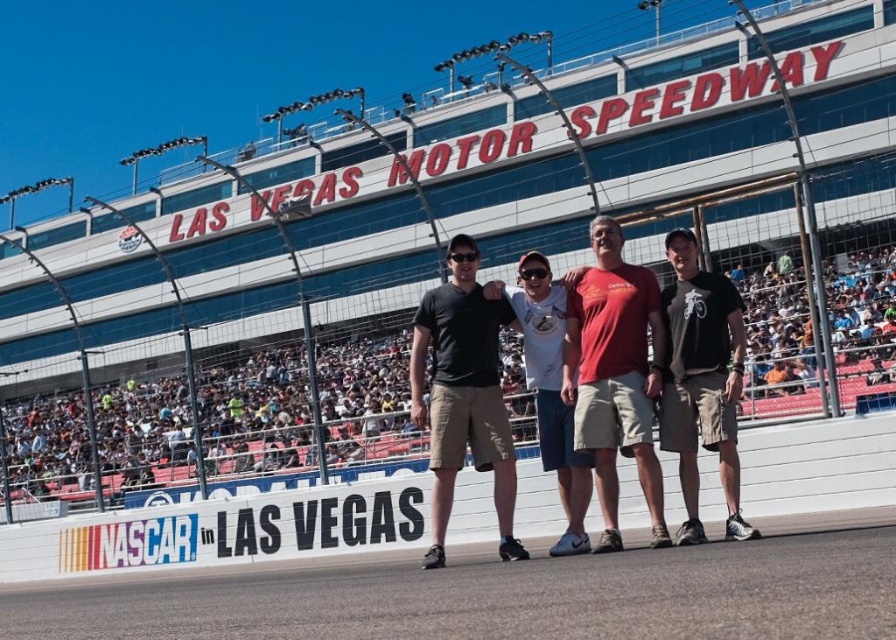
Does gray asphalt dirt track at lower center appear on the left side of matte black t-shirt at center?

Yes, gray asphalt dirt track at lower center is to the left of matte black t-shirt at center.

Between gray asphalt dirt track at lower center and matte black t-shirt at center, which one has more height?

matte black t-shirt at center is taller.

Does point (66, 634) lie in front of point (485, 445)?

Yes.

Where is `gray asphalt dirt track at lower center`? The width and height of the screenshot is (896, 640). gray asphalt dirt track at lower center is located at coordinates (498, 596).

Is black cotton t-shirt at right wider than white cotton t-shirt at center?

No.

Between black cotton t-shirt at right and white cotton t-shirt at center, which one appears on the right side from the viewer's perspective?

black cotton t-shirt at right

Measure the distance between point (x=660, y=422) and camera.

They are 37.19 meters apart.

Where is `black cotton t-shirt at right`? The width and height of the screenshot is (896, 640). black cotton t-shirt at right is located at coordinates (701, 380).

Can you confirm if matte red t-shirt at center is bigger than black cotton t-shirt at right?

Yes.

The height and width of the screenshot is (640, 896). Identify the location of matte red t-shirt at center. (614, 374).

Is point (599, 486) behind point (695, 253)?

No, it is not.

The height and width of the screenshot is (640, 896). I want to click on matte red t-shirt at center, so click(x=614, y=374).